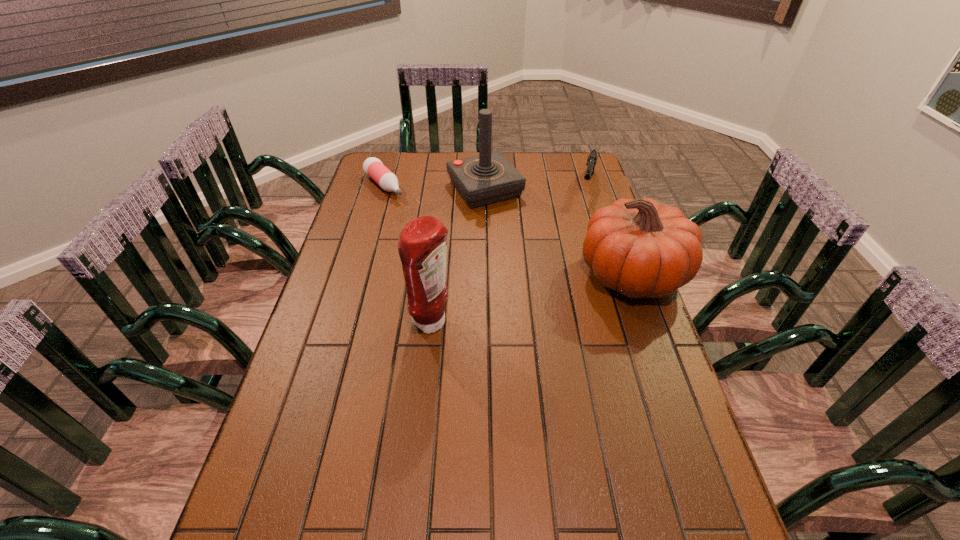
Image resolution: width=960 pixels, height=540 pixels. I want to click on condiment, so click(422, 245).

Find the location of `the third tallest object`. the third tallest object is located at coordinates (640, 248).

The image size is (960, 540). What are the coordinates of `joystick` in the screenshot? It's located at (488, 178).

Find the location of a particular element. The width and height of the screenshot is (960, 540). the second shortest object is located at coordinates (592, 158).

At what (x,y) coordinates should I click in order to perform the action: click on the shortest object. Please return your answer as a coordinate pair (x, y). This screenshot has height=540, width=960. Looking at the image, I should click on (373, 167).

The width and height of the screenshot is (960, 540). Find the location of `the leftmost object`. the leftmost object is located at coordinates point(373,167).

Identify the location of vacant space located 0.150m on the front of the condiment. (425, 395).

Where is `vacant area situated on the rectangular base of the joystick`? This screenshot has width=960, height=540. vacant area situated on the rectangular base of the joystick is located at coordinates (x=533, y=250).

This screenshot has width=960, height=540. I want to click on vacant space located 0.060m on the rectangular base of the joystick, so click(509, 219).

At what (x,y) coordinates should I click in order to perform the action: click on vacant space located on the rectangular base of the joystick. Please return your answer as a coordinate pair (x, y). This screenshot has width=960, height=540. Looking at the image, I should click on (510, 221).